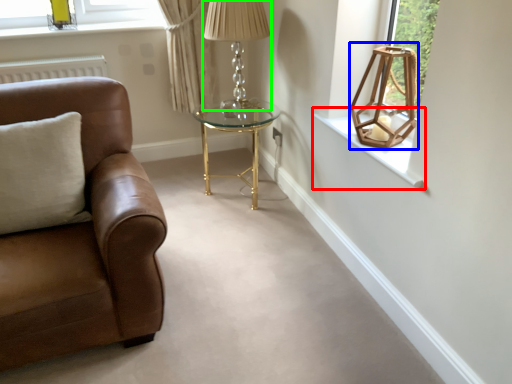
Question: Based on their relative distances, which object is farther from window sill (highlighted by a red box)? Choose from lamp (highlighted by a blue box) and table lamp (highlighted by a green box).

Choices:
 (A) lamp
 (B) table lamp

Answer: (B)